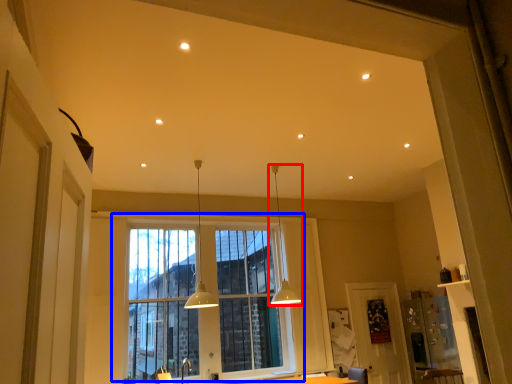
Question: Which of the following is the closest to the observer, lamp (highlighted by a red box) or window (highlighted by a blue box)?

Choices:
 (A) lamp
 (B) window

Answer: (A)